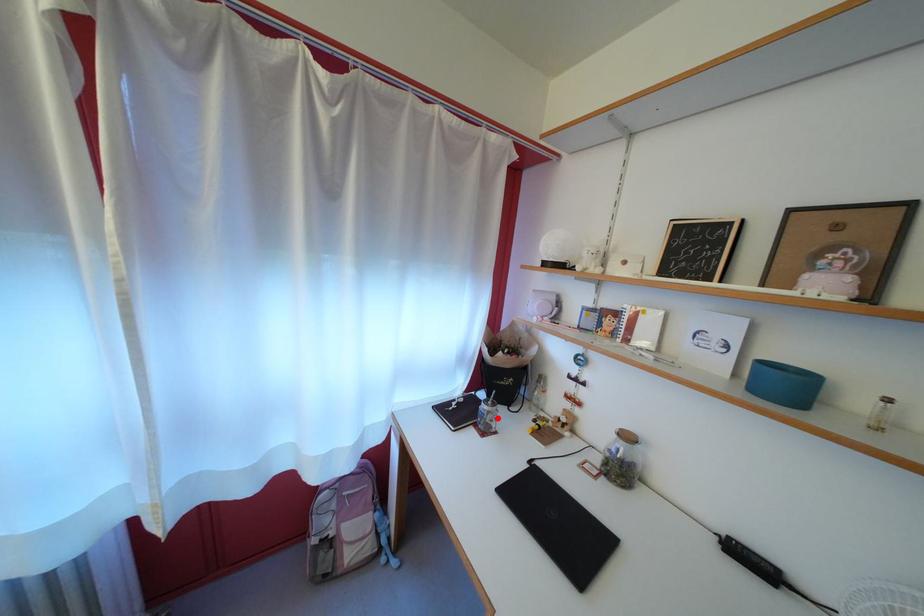
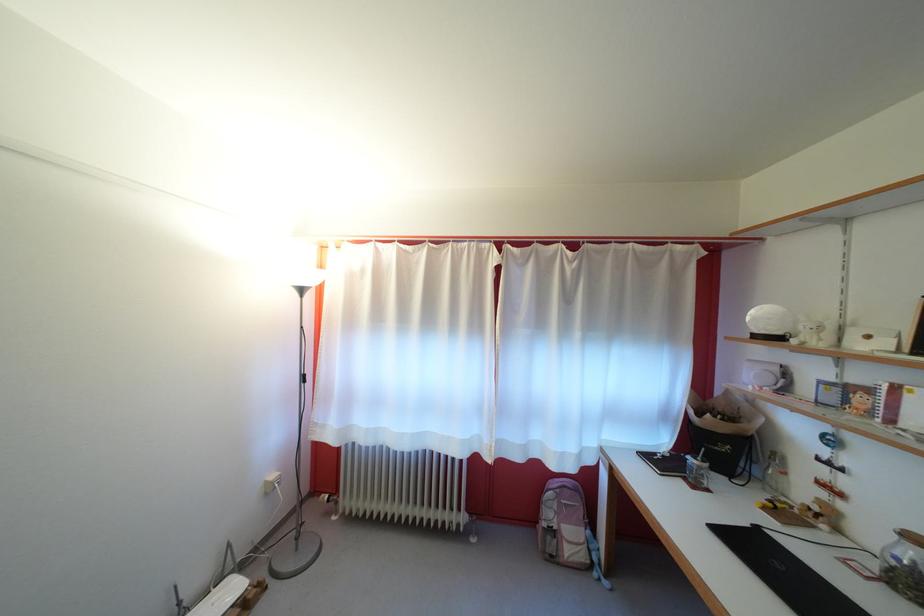
In the second image, find the point that corresponds to the highlighted location in the first image.

(708, 474)